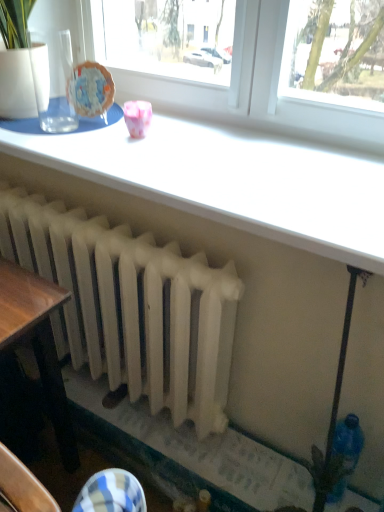
Question: From the image's perspective, is white glossy table at upper center positioned above or below pink glossy cup at upper center?

Choices:
 (A) below
 (B) above

Answer: (A)

Question: Considering the positions of white glossy table at upper center and pink glossy cup at upper center in the image, is white glossy table at upper center wider or thinner than pink glossy cup at upper center?

Choices:
 (A) wide
 (B) thin

Answer: (A)

Question: Which of these objects is positioned farthest from the white glossy table at upper center?

Choices:
 (A) pink glossy cup at upper center
 (B) white matte radiator at center

Answer: (B)

Question: Based on their relative distances, which object is nearer to the white matte radiator at center?

Choices:
 (A) pink glossy cup at upper center
 (B) white glossy table at upper center

Answer: (B)